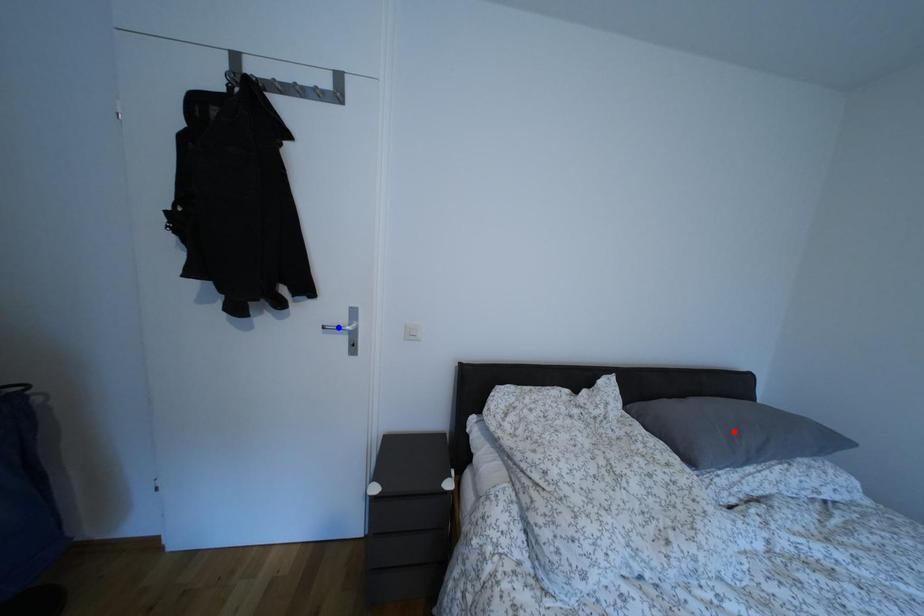
Question: In the image, two points are highlighted. Which point is nearer to the camera? Reply with the corresponding letter.

Choices:
 (A) blue point
 (B) red point

Answer: (B)